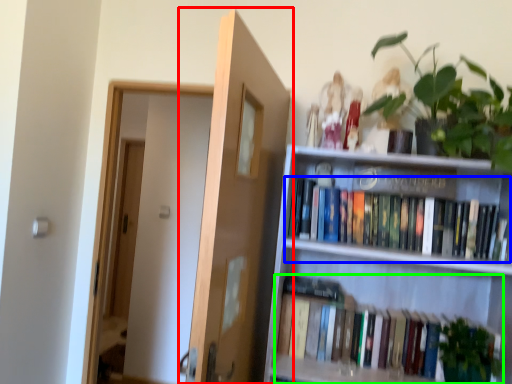
Question: Which object is the farthest from door (highlighted by a red box)? Choose among these: book (highlighted by a blue box) or book (highlighted by a green box).

Choices:
 (A) book
 (B) book

Answer: (A)